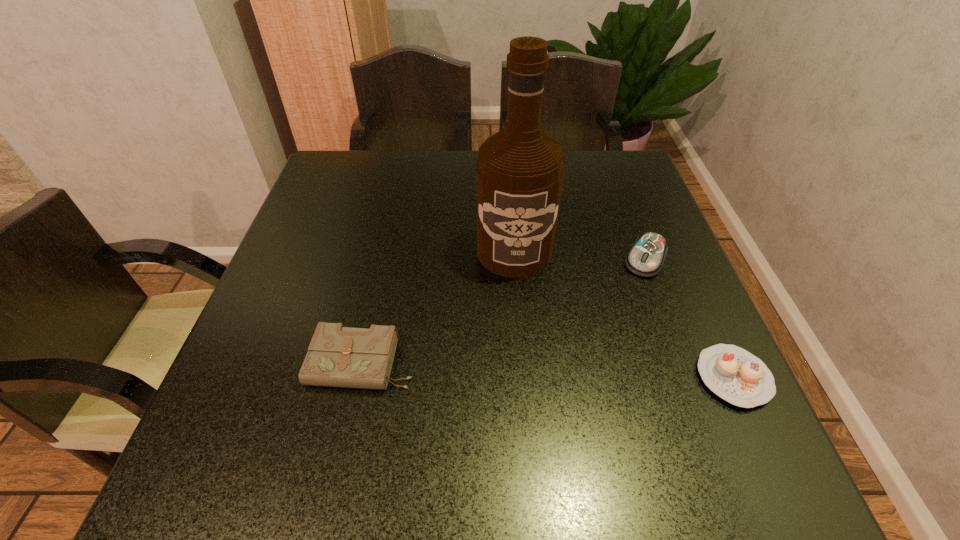
You are a GUI agent. You are given a task and a screenshot of the screen. Output one action in this format:
    pyautogui.click(x=<x>, y=<y>)
    Task: Click on the vacant space on the desktop that is between the leftmost object and the cupcake and is positioned on the wheel side of the computer mouse
    The image size is (960, 540).
    Given the screenshot: What is the action you would take?
    pyautogui.click(x=588, y=372)

Find the location of `free spot on the desktop that is between the diary and the cupcake and is positioned on the label of the second object from left to right`. free spot on the desktop that is between the diary and the cupcake and is positioned on the label of the second object from left to right is located at coordinates (518, 369).